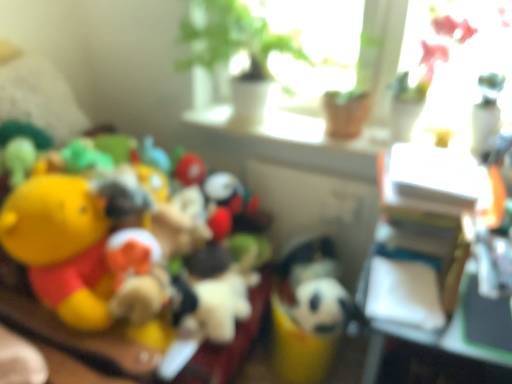
Question: Could you tell me if white glossy window sill at upper center is turned towards white plush toy at center, which is the 2th toy in left-to-right order?

Choices:
 (A) yes
 (B) no

Answer: (B)

Question: Does white glossy window sill at upper center have a greater width compared to white plush toy at center, which is the 1th toy from right to left?

Choices:
 (A) yes
 (B) no

Answer: (B)

Question: Considering the relative sizes of white glossy window sill at upper center and white plush toy at center, which is the 2th toy in left-to-right order, in the image provided, is white glossy window sill at upper center shorter than white plush toy at center, which is the 2th toy in left-to-right order,?

Choices:
 (A) yes
 (B) no

Answer: (A)

Question: Is white glossy window sill at upper center bigger than white plush toy at center, which is the 2th toy in left-to-right order?

Choices:
 (A) yes
 (B) no

Answer: (B)

Question: Is white plush toy at center, which is the 1th toy from right to left, at the back of white glossy window sill at upper center?

Choices:
 (A) no
 (B) yes

Answer: (A)

Question: Can you confirm if white glossy window sill at upper center is positioned to the left of white plush toy at center, which is the 1th toy from right to left?

Choices:
 (A) no
 (B) yes

Answer: (A)

Question: Does white glossy window sill at upper center come behind yellow plush toy at left, the 2th toy positioned from the right?

Choices:
 (A) yes
 (B) no

Answer: (A)

Question: Is white glossy window sill at upper center taller than yellow plush toy at left, the 1th toy in the left-to-right sequence?

Choices:
 (A) no
 (B) yes

Answer: (A)

Question: Is white glossy window sill at upper center facing towards yellow plush toy at left, the 1th toy in the left-to-right sequence?

Choices:
 (A) yes
 (B) no

Answer: (B)

Question: From a real-world perspective, is white glossy window sill at upper center over yellow plush toy at left, the 2th toy positioned from the right?

Choices:
 (A) no
 (B) yes

Answer: (B)

Question: Is white glossy window sill at upper center not inside yellow plush toy at left, the 1th toy in the left-to-right sequence?

Choices:
 (A) no
 (B) yes

Answer: (B)

Question: Does white glossy window sill at upper center have a lesser height compared to yellow plush toy at left, the 1th toy in the left-to-right sequence?

Choices:
 (A) no
 (B) yes

Answer: (B)

Question: Considering the relative sizes of white plush toy at center, which is the 1th toy from right to left, and yellow plush toy at left, the 2th toy positioned from the right, in the image provided, is white plush toy at center, which is the 1th toy from right to left, bigger than yellow plush toy at left, the 2th toy positioned from the right,?

Choices:
 (A) yes
 (B) no

Answer: (B)